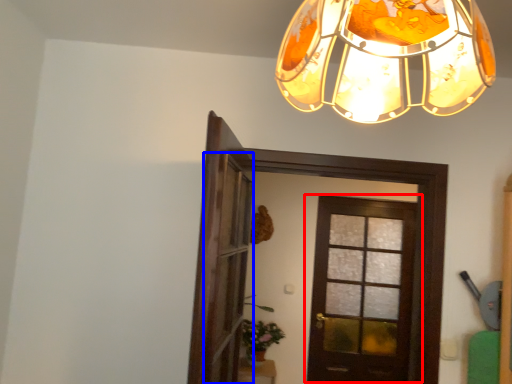
Question: Which object is closer to the camera taking this photo, door (highlighted by a red box) or screen door (highlighted by a blue box)?

Choices:
 (A) door
 (B) screen door

Answer: (B)